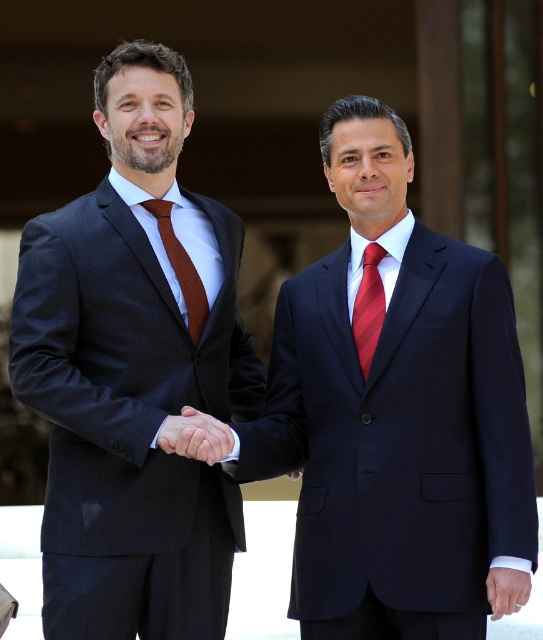
Question: Can you confirm if matte black suit at center is thinner than brown silk tie at center?

Choices:
 (A) no
 (B) yes

Answer: (A)

Question: Does smooth skin handshake at center have a larger size compared to red striped tie at center?

Choices:
 (A) yes
 (B) no

Answer: (A)

Question: Estimate the real-world distances between objects in this image. Which object is closer to the smooth skin handshake at center?

Choices:
 (A) brown silk tie at center
 (B) matte black suit at center
 (C) matte black suit at left

Answer: (C)

Question: Which object is the closest to the matte black suit at left?

Choices:
 (A) red striped tie at center
 (B) brown silk tie at center
 (C) smooth skin handshake at center
 (D) matte black suit at center

Answer: (B)

Question: Which of the following is the farthest from the observer?

Choices:
 (A) red striped tie at center
 (B) brown silk tie at center
 (C) smooth skin handshake at center
 (D) matte black suit at left

Answer: (B)

Question: Observing the image, what is the correct spatial positioning of matte black suit at left in reference to brown silk tie at center?

Choices:
 (A) left
 (B) right

Answer: (A)